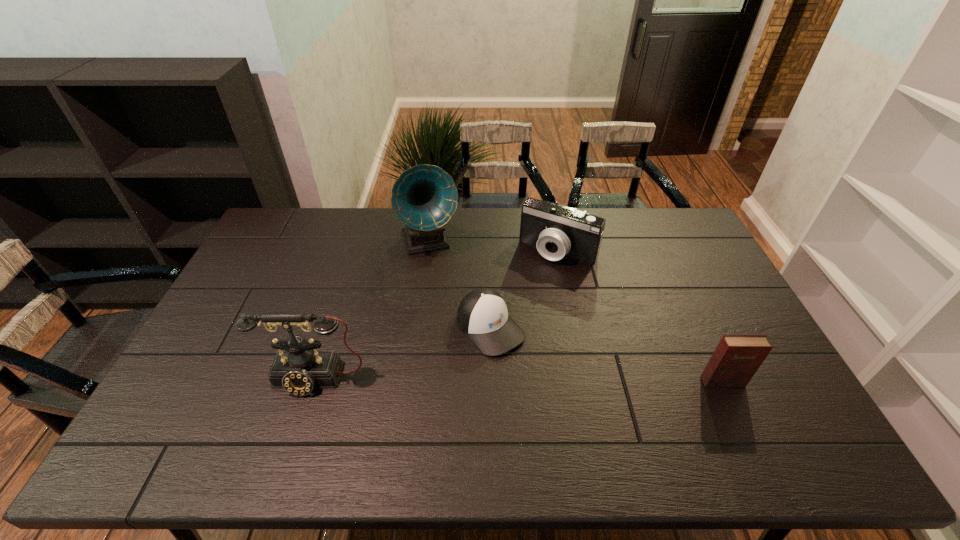
Identify the location of telephone. (299, 369).

Identify the location of the fourth shortest object. Image resolution: width=960 pixels, height=540 pixels. (299, 369).

Where is `diary`? diary is located at coordinates (736, 359).

Identify the location of the second object from right to left. This screenshot has width=960, height=540. (557, 231).

This screenshot has width=960, height=540. I want to click on phonograph_record, so click(x=424, y=197).

The height and width of the screenshot is (540, 960). What are the coordinates of `the fourth object from right to left` in the screenshot? It's located at (424, 197).

Where is `the third object from left to right`? Image resolution: width=960 pixels, height=540 pixels. the third object from left to right is located at coordinates (482, 315).

Identify the location of the third farthest object. The image size is (960, 540). coord(482,315).

The width and height of the screenshot is (960, 540). What are the coordinates of `vacant space situated 0.050m on the front cover of the diary` in the screenshot? It's located at (732, 404).

The height and width of the screenshot is (540, 960). In order to click on vacant point located on the lens of the camcorder in this screenshot , I will do `click(526, 292)`.